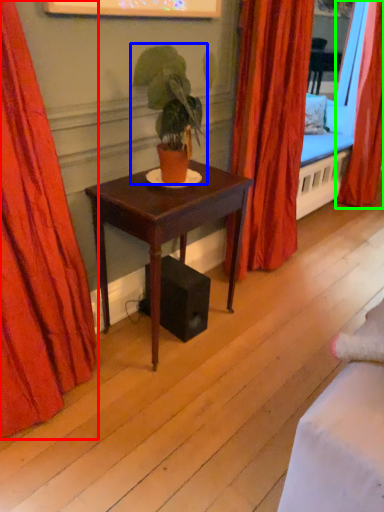
Question: Estimate the real-world distances between objects in this image. Which object is farther from curtain (highlighted by a red box), houseplant (highlighted by a blue box) or curtain (highlighted by a green box)?

Choices:
 (A) houseplant
 (B) curtain

Answer: (B)